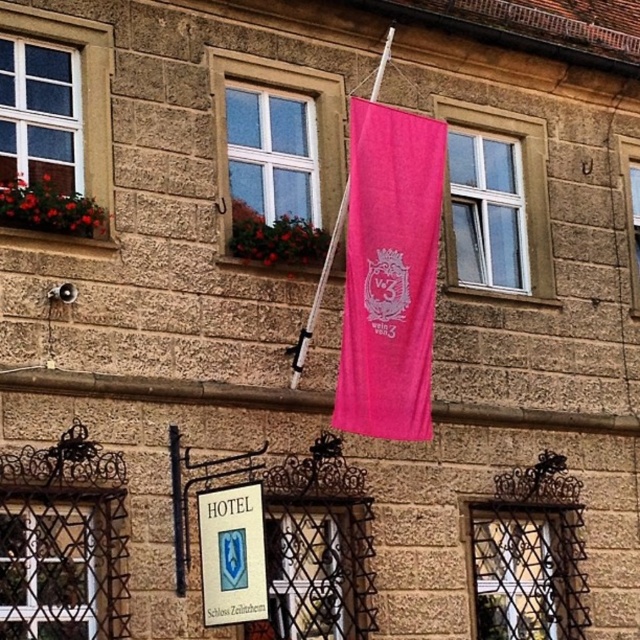
Question: Among these objects, which one is nearest to the camera?

Choices:
 (A) pink fabric flag at upper center
 (B) matte glass window at center

Answer: (A)

Question: Based on their relative distances, which object is farther from the clear glass window at upper left?

Choices:
 (A) metallic wire mesh at center
 (B) pink fabric flag at upper center
 (C) clear glass window at upper center
 (D) matte white window at upper left

Answer: (A)

Question: Which point is closer to the camera?

Choices:
 (A) (42, 17)
 (B) (532, 150)
 (C) (339, 532)

Answer: (A)

Question: Considering the relative positions of metallic wire mesh at lower left and transparent glass window at center in the image provided, where is metallic wire mesh at lower left located with respect to transparent glass window at center?

Choices:
 (A) right
 (B) left

Answer: (B)

Question: Is metallic wire mesh at lower right wider than transparent glass window at center?

Choices:
 (A) yes
 (B) no

Answer: (B)

Question: Considering the relative positions of metallic wire mesh at lower right and matte glass window at center in the image provided, where is metallic wire mesh at lower right located with respect to matte glass window at center?

Choices:
 (A) left
 (B) right

Answer: (B)